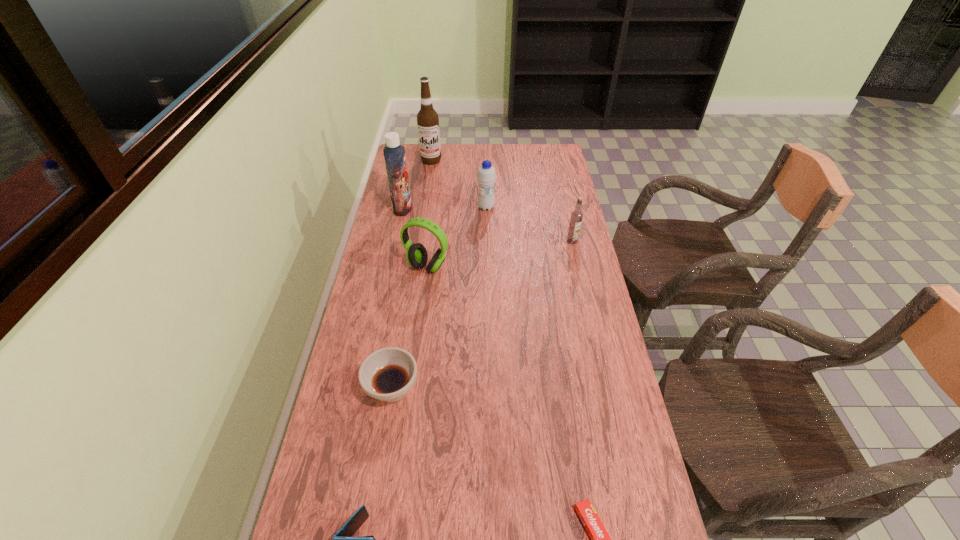
The image size is (960, 540). I want to click on alcohol, so click(427, 118).

Identify the location of the farthest object. The height and width of the screenshot is (540, 960). (427, 118).

The height and width of the screenshot is (540, 960). What are the coordinates of `the seventh shortest object` in the screenshot? It's located at (394, 154).

Where is `the sixth object from left to right`? The height and width of the screenshot is (540, 960). the sixth object from left to right is located at coordinates (486, 176).

The height and width of the screenshot is (540, 960). Identify the location of headset. (416, 255).

At what (x,y) coordinates should I click in order to perform the action: click on vodka. Please return your answer as a coordinate pair (x, y). Looking at the image, I should click on (576, 217).

This screenshot has width=960, height=540. What are the coordinates of `the fourth farthest object` in the screenshot? It's located at (576, 217).

Find the location of `the third shortest object`. the third shortest object is located at coordinates (387, 374).

At what (x,y) coordinates should I click in order to perform the action: click on soup bowl. Please return your answer as a coordinate pair (x, y). Looking at the image, I should click on (387, 374).

Find the location of a particular element. This screenshot has width=960, height=540. vacant space located on the label of the tallest object is located at coordinates (423, 212).